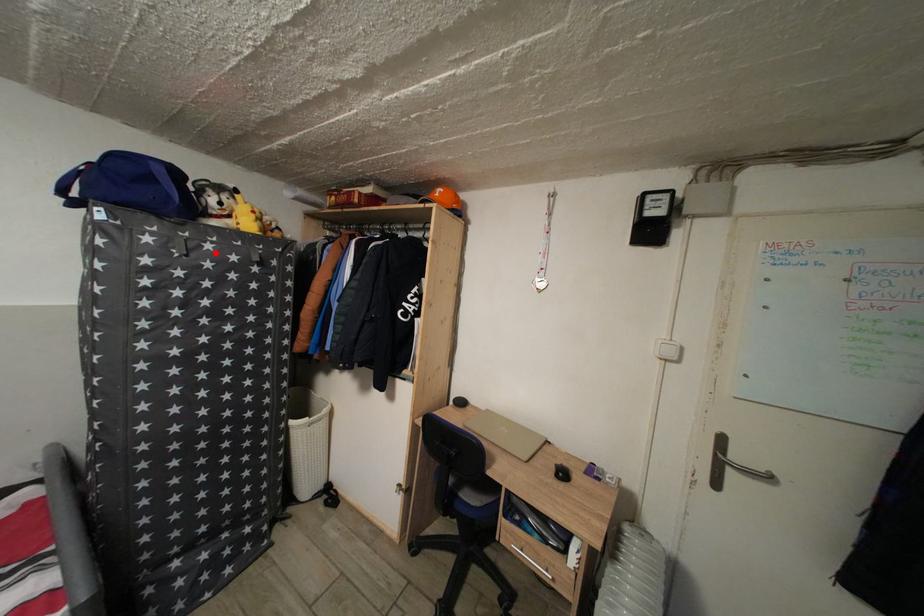
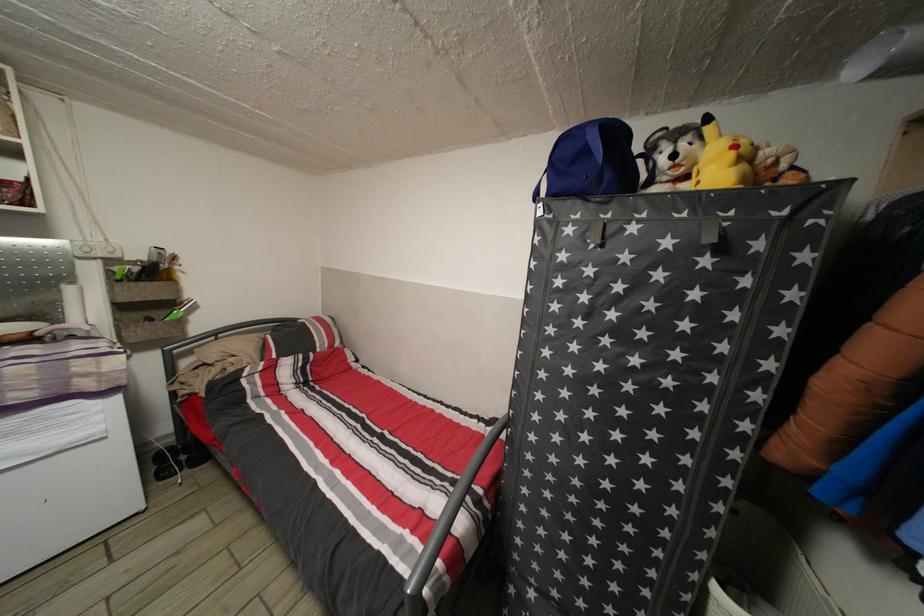
Find the pixel in the second image that matches the highlighted location in the first image.

(639, 235)